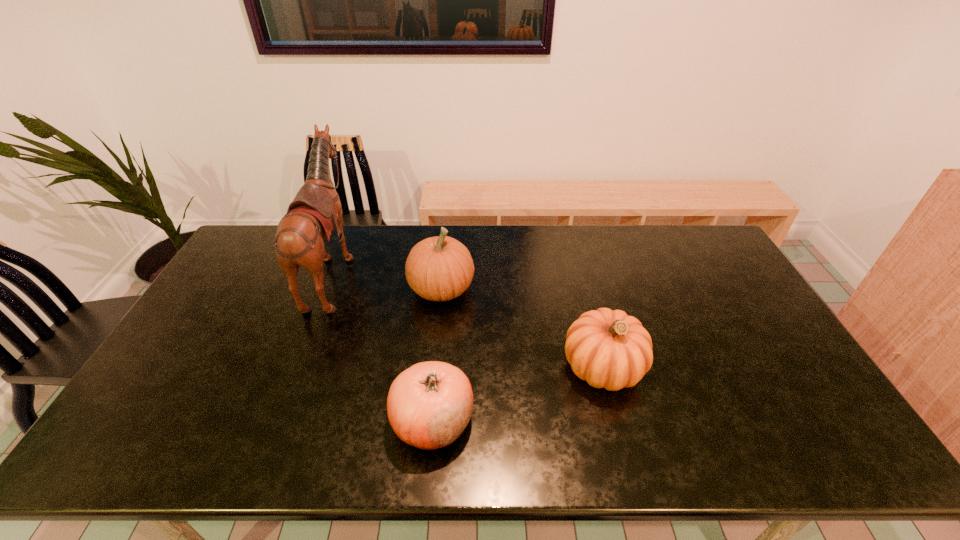
The image size is (960, 540). I want to click on free space at the near edge of the desktop, so click(754, 442).

Where is `free space at the left edge of the desktop`? free space at the left edge of the desktop is located at coordinates (x=215, y=302).

Identify the location of vacant area at the right edge of the desktop. The width and height of the screenshot is (960, 540). (722, 282).

Find the location of a particular element. Image resolution: width=960 pixels, height=540 pixels. vacant space at the far left corner is located at coordinates (265, 224).

I want to click on vacant space at the near left corner of the desktop, so click(x=168, y=457).

In the image, there is a desktop. In order to click on vacant space at the far right corner in this screenshot , I will do `click(693, 260)`.

Find the location of a particular element. The height and width of the screenshot is (540, 960). free space between the leftmost object and the farthest pumpkin is located at coordinates (388, 280).

The width and height of the screenshot is (960, 540). Find the location of `blank region between the tallest object and the rightmost pumpkin`. blank region between the tallest object and the rightmost pumpkin is located at coordinates (468, 319).

The height and width of the screenshot is (540, 960). I want to click on free space between the farthest pumpkin and the rightmost object, so click(x=522, y=328).

Where is `unoccupied area between the rightmost pumpkin and the leftmost object`? unoccupied area between the rightmost pumpkin and the leftmost object is located at coordinates (468, 319).